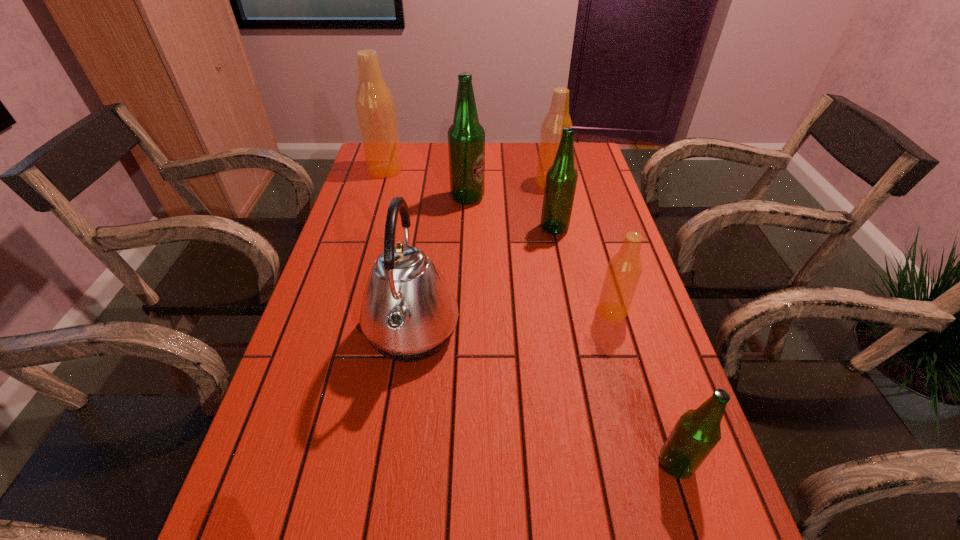
Identify the location of free spot between the smallest green beer bottle and the kettle. (544, 398).

This screenshot has width=960, height=540. What are the coordinates of `free space between the nearest object and the leftmost green beer bottle` in the screenshot? It's located at (572, 331).

The image size is (960, 540). What are the coordinates of `vacant point located between the kettle and the second biggest tan beer bottle` in the screenshot? It's located at (481, 258).

This screenshot has width=960, height=540. I want to click on vacant region between the second beer bottle from left to right and the kettle, so click(440, 265).

Identify the location of vacant space that is in between the nearest green beer bottle and the second biggest tan beer bottle. (613, 323).

At what (x,y) coordinates should I click in order to perform the action: click on unoccupied position between the nearest object and the leftmost object. Please return your answer as a coordinate pair (x, y). The image size is (960, 540). Looking at the image, I should click on (531, 316).

This screenshot has width=960, height=540. I want to click on object that is the closest to the second biggest tan beer bottle, so click(x=561, y=179).

Locate an element on the screen. object identified as the fifth closest to the nearest object is located at coordinates (558, 117).

Where is `beer bottle that is the fourth closest to the biggest green beer bottle`? The image size is (960, 540). beer bottle that is the fourth closest to the biggest green beer bottle is located at coordinates (624, 270).

Select which beer bottle appears as the second closest to the fourth farthest beer bottle. Please provide its 2D coordinates. Your answer should be formatted as a tuple, i.e. [(x, y)], where the tuple contains the x and y coordinates of a point satisfying the conditions above.

[(466, 137)]